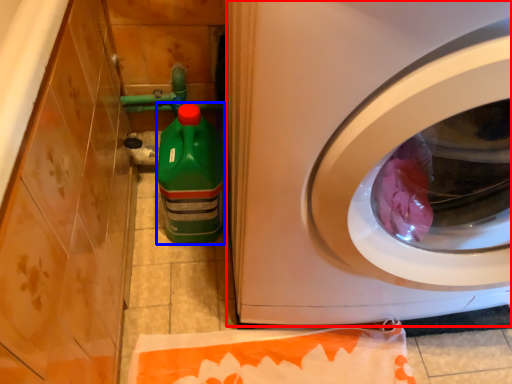
Question: Which object is closer to the camera taking this photo, washing machine (highlighted by a red box) or cleaning product (highlighted by a blue box)?

Choices:
 (A) washing machine
 (B) cleaning product

Answer: (A)